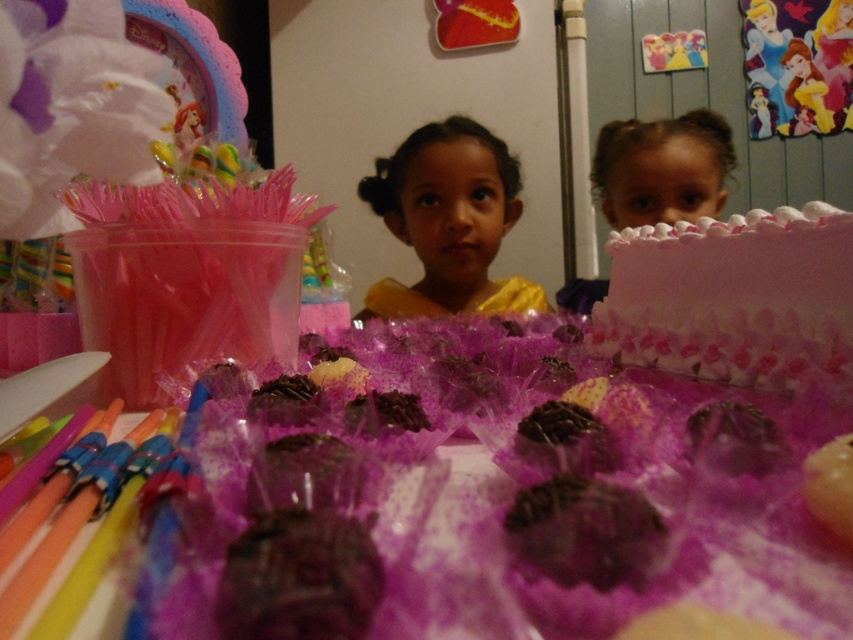
Question: Is pink frosted cake at right above chocolate-coated truffle at center?

Choices:
 (A) no
 (B) yes

Answer: (B)

Question: Can you confirm if yellow satin dress at center is positioned to the left of chocolate-coated truffle at center?

Choices:
 (A) yes
 (B) no

Answer: (B)

Question: Is pink frosted cake at right smaller than chocolate-coated truffle at center?

Choices:
 (A) yes
 (B) no

Answer: (B)

Question: Which object is farther from the camera taking this photo?

Choices:
 (A) chocolate-coated truffle at center
 (B) smooth pink cake at upper right

Answer: (B)

Question: Which point appears farthest from the camera in this image?

Choices:
 (A) (393, 291)
 (B) (257, 589)
 (C) (606, 211)

Answer: (C)

Question: Which point is farther to the camera?

Choices:
 (A) (451, 248)
 (B) (850, 262)
 (C) (306, 547)

Answer: (A)